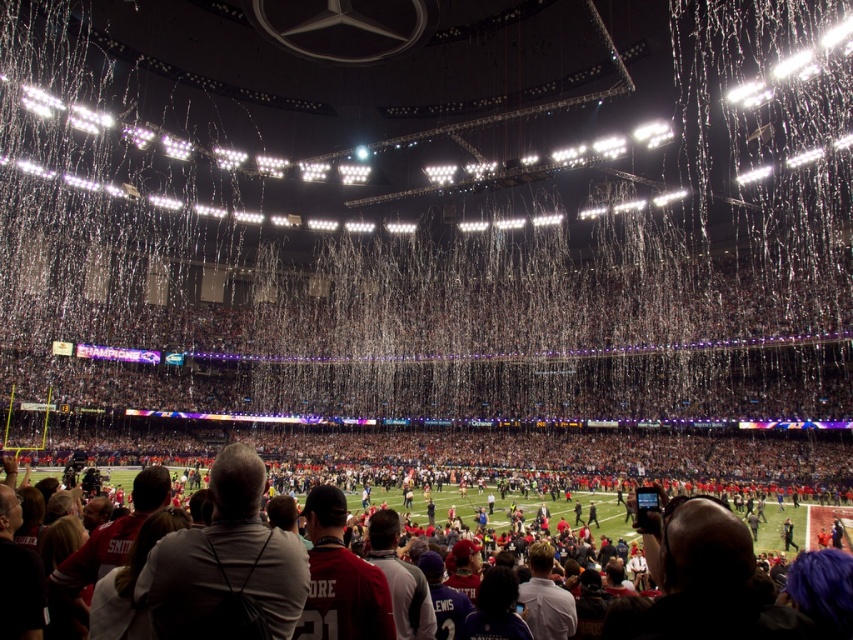
Is white paper confetti at center smaller than red jersey football team at lower center?

No, white paper confetti at center is not smaller than red jersey football team at lower center.

Which of these two, white paper confetti at center or red jersey football team at lower center, stands shorter?

red jersey football team at lower center

Between point (282, 320) and point (698, 486), which one is positioned in front?

Point (698, 486) is in front.

This screenshot has width=853, height=640. What are the coordinates of `white paper confetti at center` in the screenshot? It's located at (445, 243).